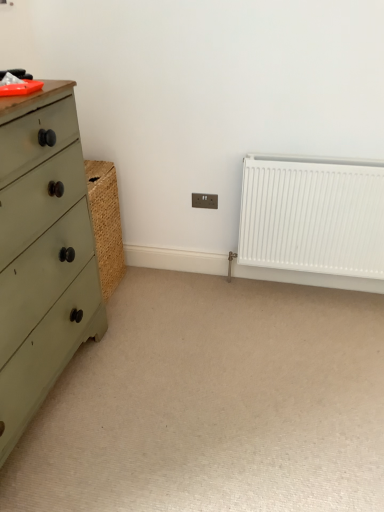
Question: From the image's perspective, is beige carpet at center beneath brown plastic electric outlet at center?

Choices:
 (A) yes
 (B) no

Answer: (A)

Question: Is brown plastic electric outlet at center completely or partially inside beige carpet at center?

Choices:
 (A) no
 (B) yes

Answer: (A)

Question: Is beige carpet at center facing away from brown plastic electric outlet at center?

Choices:
 (A) yes
 (B) no

Answer: (B)

Question: Is beige carpet at center far away from brown plastic electric outlet at center?

Choices:
 (A) yes
 (B) no

Answer: (A)

Question: Considering the relative sizes of beige carpet at center and brown plastic electric outlet at center in the image provided, is beige carpet at center thinner than brown plastic electric outlet at center?

Choices:
 (A) yes
 (B) no

Answer: (B)

Question: Considering the relative sizes of beige carpet at center and brown plastic electric outlet at center in the image provided, is beige carpet at center smaller than brown plastic electric outlet at center?

Choices:
 (A) no
 (B) yes

Answer: (A)

Question: Is green matte chest of drawers at left directly adjacent to brown plastic electric outlet at center?

Choices:
 (A) no
 (B) yes

Answer: (A)

Question: Is green matte chest of drawers at left wider than brown plastic electric outlet at center?

Choices:
 (A) no
 (B) yes

Answer: (B)

Question: Does green matte chest of drawers at left turn towards brown plastic electric outlet at center?

Choices:
 (A) yes
 (B) no

Answer: (B)

Question: From the image's perspective, does green matte chest of drawers at left appear lower than brown plastic electric outlet at center?

Choices:
 (A) yes
 (B) no

Answer: (A)

Question: Is green matte chest of drawers at left not inside brown plastic electric outlet at center?

Choices:
 (A) yes
 (B) no

Answer: (A)

Question: Would you say green matte chest of drawers at left contains brown plastic electric outlet at center?

Choices:
 (A) no
 (B) yes

Answer: (A)

Question: From a real-world perspective, is white matte radiator at right positioned under beige carpet at center based on gravity?

Choices:
 (A) yes
 (B) no

Answer: (B)